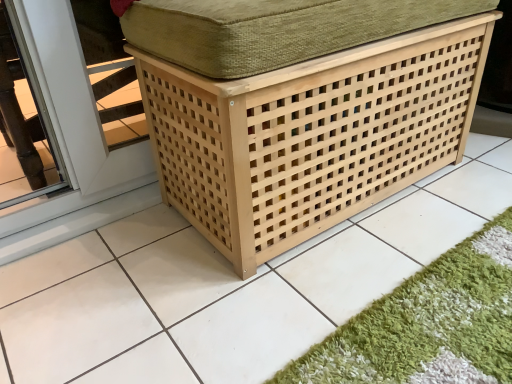
The height and width of the screenshot is (384, 512). Find the location of `vacant area that is in front of natural wood lattice storage box at center`. vacant area that is in front of natural wood lattice storage box at center is located at coordinates (292, 282).